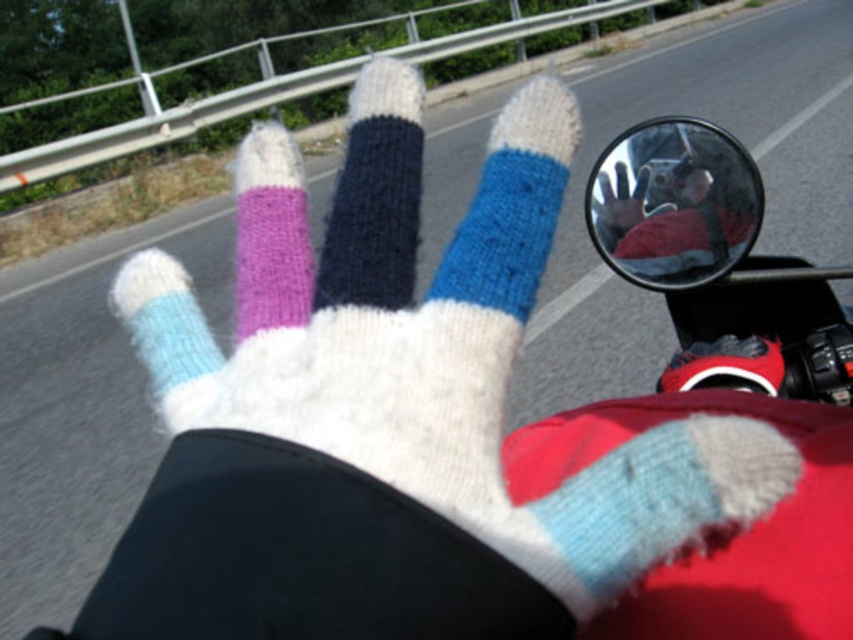
Question: Is the position of light blue knitted sock at lower right less distant than that of white knitted glove at center?

Choices:
 (A) yes
 (B) no

Answer: (A)

Question: Among these objects, which one is farthest from the camera?

Choices:
 (A) clear glass mirror at upper right
 (B) purple knitted sock at center
 (C) white knitted sock at center
 (D) knitted wool sock at center

Answer: (B)

Question: Among these objects, which one is farthest from the camera?

Choices:
 (A) purple knitted sock at center
 (B) blue knitted sock at center
 (C) knitted wool sock at center
 (D) white knitted glove at center

Answer: (A)

Question: Can you confirm if knitted wool sock at center is positioned above purple knitted sock at center?

Choices:
 (A) no
 (B) yes

Answer: (A)

Question: Is the position of light blue knitted sock at lower right less distant than that of white knitted glove at center?

Choices:
 (A) yes
 (B) no

Answer: (A)

Question: Which point is closer to the camera?

Choices:
 (A) (368, 237)
 (B) (663, 154)
 (C) (631, 180)

Answer: (A)